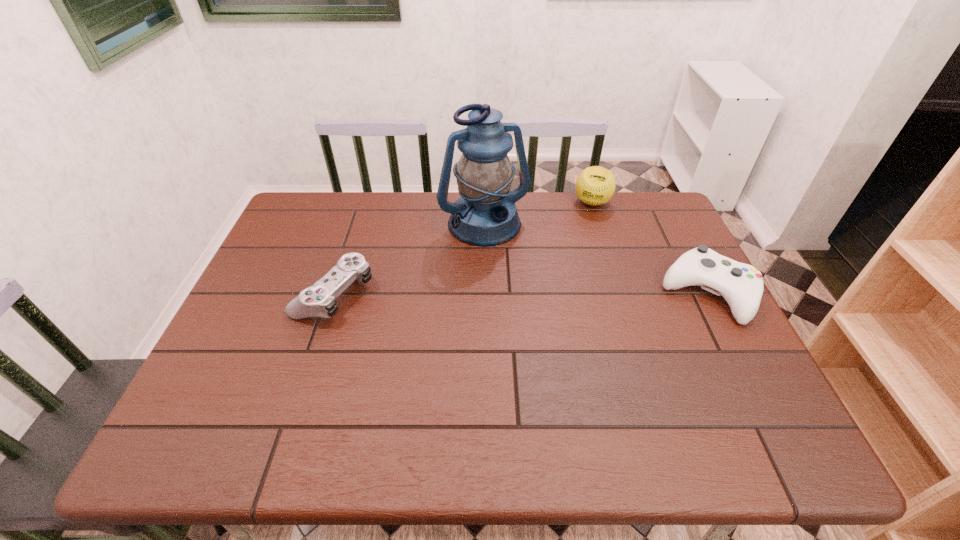
You are a GUI agent. You are given a task and a screenshot of the screen. Output one action in this format:
    pyautogui.click(x=<x>, y=<y>)
    Task: Click on the vacant region located on the face of the third object from right to left
    
    Given the screenshot: What is the action you would take?
    pyautogui.click(x=529, y=300)

What are the coordinates of `vacant region located 0.060m on the logo side of the softball` in the screenshot? It's located at (588, 224).

Locate an element on the screen. vacant space situated on the logo side of the softball is located at coordinates (576, 282).

Identify the location of free location located on the logo side of the softball. (578, 275).

Identify the location of lantern that is at the far edge. This screenshot has width=960, height=540. (485, 214).

Where is `softball located at the far edge`? The image size is (960, 540). softball located at the far edge is located at coordinates (595, 185).

The width and height of the screenshot is (960, 540). I want to click on object that is at the left edge, so 319,300.

The height and width of the screenshot is (540, 960). Find the location of `object at the right edge`. object at the right edge is located at coordinates (741, 285).

The width and height of the screenshot is (960, 540). In the image, there is a desktop. What are the coordinates of `vacant space at the far edge` in the screenshot? It's located at (391, 203).

Image resolution: width=960 pixels, height=540 pixels. I want to click on free space at the near edge of the desktop, so click(586, 399).